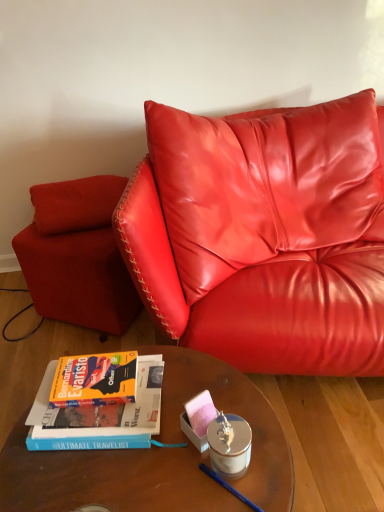
Locate an element on the screen. The image size is (384, 512). free spot in front of hardcover book at lower left is located at coordinates (104, 479).